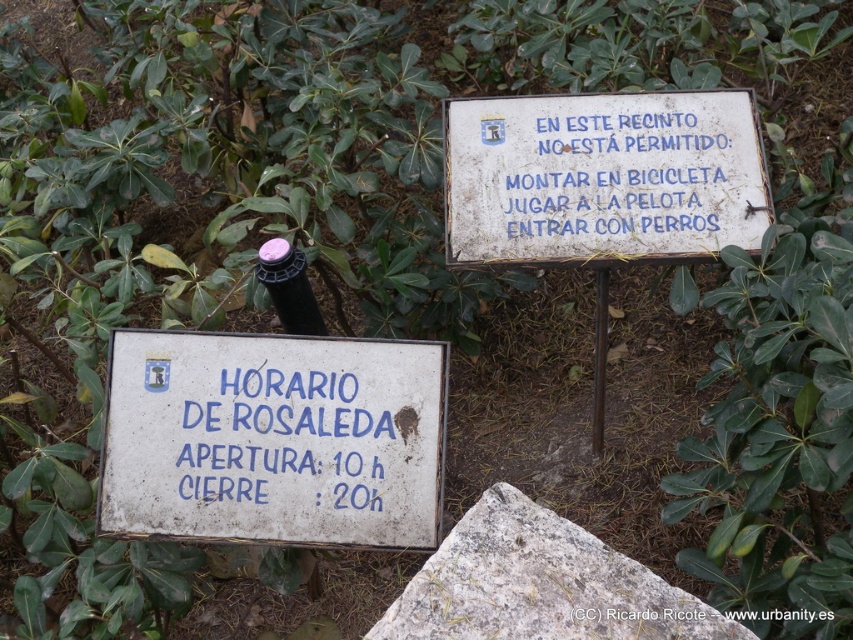
Question: Which point is closer to the camera?

Choices:
 (A) white painted wood sign at upper center
 (B) pink plastic wine bottle at center
 (C) white painted metal sign at center

Answer: (C)

Question: Does white painted metal sign at center have a greater width compared to pink plastic wine bottle at center?

Choices:
 (A) yes
 (B) no

Answer: (A)

Question: Does white painted wood sign at upper center appear over pink plastic wine bottle at center?

Choices:
 (A) yes
 (B) no

Answer: (A)

Question: Does white painted metal sign at center have a lesser width compared to gray granite stone at center?

Choices:
 (A) no
 (B) yes

Answer: (A)

Question: Among these points, which one is farthest from the camera?

Choices:
 (A) 354,380
 (B) 561,204
 (C) 271,260
 (D) 657,593

Answer: (B)

Question: Among these points, which one is nearest to the camera?

Choices:
 (A) (271, 237)
 (B) (540, 634)
 (C) (393, 490)

Answer: (B)